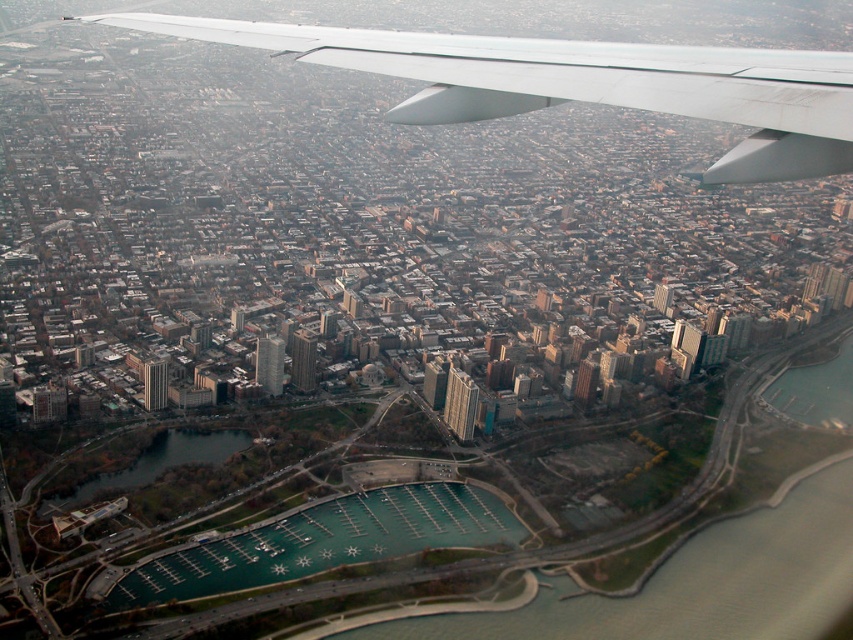
You are a pilot flying over a city and notice two landmarks in the image below. The first is the white matte wing at upper center, and the second is the green water at lower center. From your perspective, which of these two landmarks is positioned to the right?

The white matte wing at upper center is to the right of the green water at lower center.

You are a drone operator trying to navigate between two green water areas in the city. You see the green water at lower center and the green water at lower left. Which one is located to the right of the other?

The green water at lower center is positioned on the right side of green water at lower left.